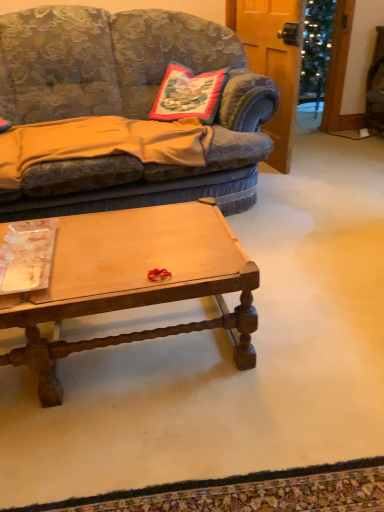
Question: From the image's perspective, is velvet fabric couch at center above light brown wood coffee table at center?

Choices:
 (A) yes
 (B) no

Answer: (A)

Question: Can you confirm if velvet fabric couch at center is shorter than light brown wood coffee table at center?

Choices:
 (A) yes
 (B) no

Answer: (B)

Question: Is velvet fabric couch at center completely or partially outside of light brown wood coffee table at center?

Choices:
 (A) no
 (B) yes

Answer: (B)

Question: Can you confirm if velvet fabric couch at center is smaller than light brown wood coffee table at center?

Choices:
 (A) yes
 (B) no

Answer: (B)

Question: Is velvet fabric couch at center positioned before light brown wood coffee table at center?

Choices:
 (A) no
 (B) yes

Answer: (A)

Question: Could you tell me if velvet fabric couch at center is turned towards light brown wood coffee table at center?

Choices:
 (A) yes
 (B) no

Answer: (A)

Question: Could you tell me if light brown wood coffee table at center is facing orange cotton blanket at left?

Choices:
 (A) no
 (B) yes

Answer: (A)

Question: Does light brown wood coffee table at center have a greater height compared to orange cotton blanket at left?

Choices:
 (A) no
 (B) yes

Answer: (B)

Question: Considering the relative positions of light brown wood coffee table at center and orange cotton blanket at left in the image provided, is light brown wood coffee table at center to the left of orange cotton blanket at left from the viewer's perspective?

Choices:
 (A) no
 (B) yes

Answer: (A)

Question: Is light brown wood coffee table at center positioned far away from orange cotton blanket at left?

Choices:
 (A) no
 (B) yes

Answer: (A)

Question: Is orange cotton blanket at left at the back of light brown wood coffee table at center?

Choices:
 (A) no
 (B) yes

Answer: (B)

Question: Does light brown wood coffee table at center have a greater width compared to orange cotton blanket at left?

Choices:
 (A) yes
 (B) no

Answer: (B)

Question: Does embroidered fabric pillow at center appear on the right side of orange cotton blanket at left?

Choices:
 (A) no
 (B) yes

Answer: (B)